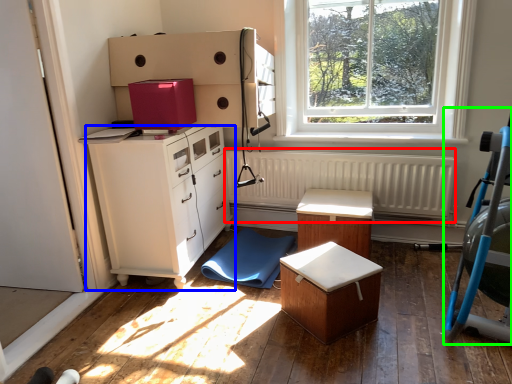
Question: Which is nearer to the radiator (highlighted by a red box)? chest of drawers (highlighted by a blue box) or baby carriage (highlighted by a green box).

Choices:
 (A) chest of drawers
 (B) baby carriage

Answer: (A)